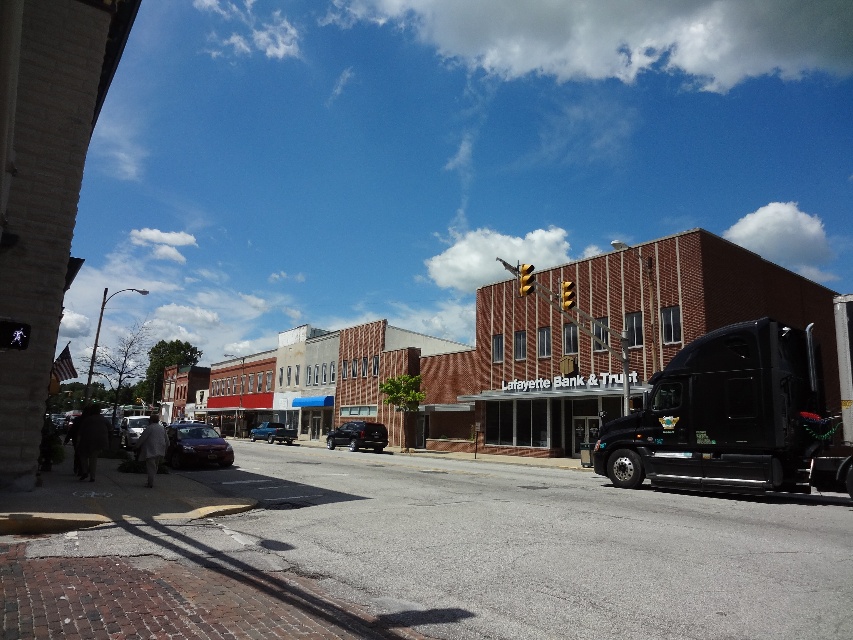
You are a delivery driver who needs to park your metallic blue truck at center in a parking spot that can only accommodate vehicles smaller than the black glossy trailer truck at right. Is your truck suitable for this parking spot?

The black glossy trailer truck at right has a smaller size compared to the metallic blue truck at center. Since the parking spot requires vehicles smaller than the black glossy trailer truck at right, the metallic blue truck at center is too large to fit in the parking spot.

Please provide the coordinates of the shiny dark red sedan at center in the image. The coordinate system is normalized, with the origin at the bottom left corner of the image. The x and y axes are measured in fractions of the image width and height respectively. Please format your answer as a tuple of two decimal numbers rounded to three decimal places, like this example format for coordinates at the center of the image would be written as 0.5, 0.5. Please do not include any other information in your answer

(196,445)

You are a pedestrian standing at the crosswalk in the image. You see a shiny dark red sedan at center and a satin black suv at center. Which vehicle is closer to you?

The shiny dark red sedan at center is closer to you than the satin black suv at center.